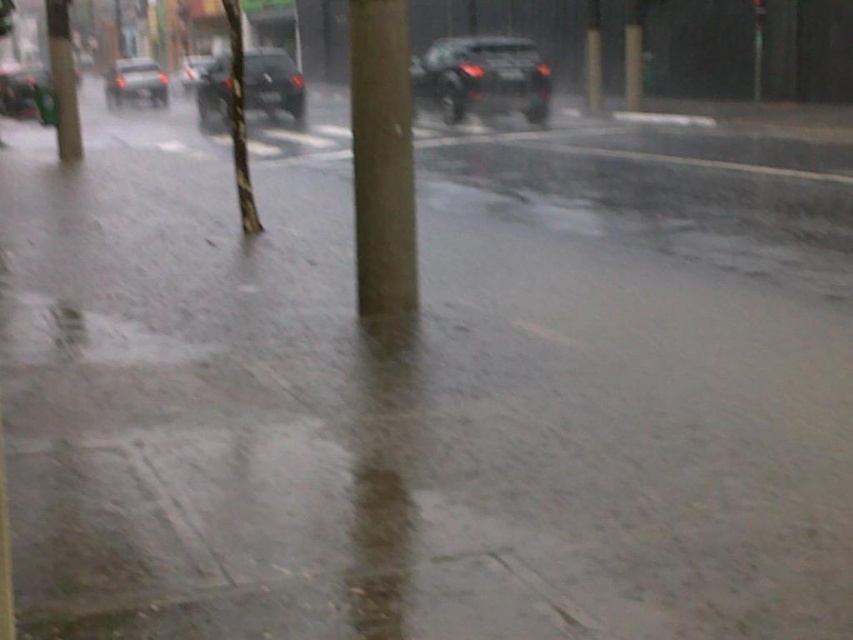
Can you confirm if brown wood pole at center is smaller than metallic silver car at left?

Indeed, brown wood pole at center has a smaller size compared to metallic silver car at left.

What do you see at coordinates (381, 157) in the screenshot? I see `brown wood pole at center` at bounding box center [381, 157].

Where is `brown wood pole at center`? The width and height of the screenshot is (853, 640). brown wood pole at center is located at coordinates (381, 157).

This screenshot has height=640, width=853. I want to click on brown wood pole at center, so click(381, 157).

Who is positioned more to the left, smooth concrete pole at left or smooth brown pole at center?

smooth concrete pole at left is more to the left.

Image resolution: width=853 pixels, height=640 pixels. I want to click on smooth concrete pole at left, so click(x=62, y=80).

Who is more distant from viewer, (67, 116) or (184, 70)?

Point (184, 70)

Who is more distant from viewer, (55, 28) or (207, 67)?

Point (207, 67)

Find the location of a particular element. smooth concrete pole at left is located at coordinates (62, 80).